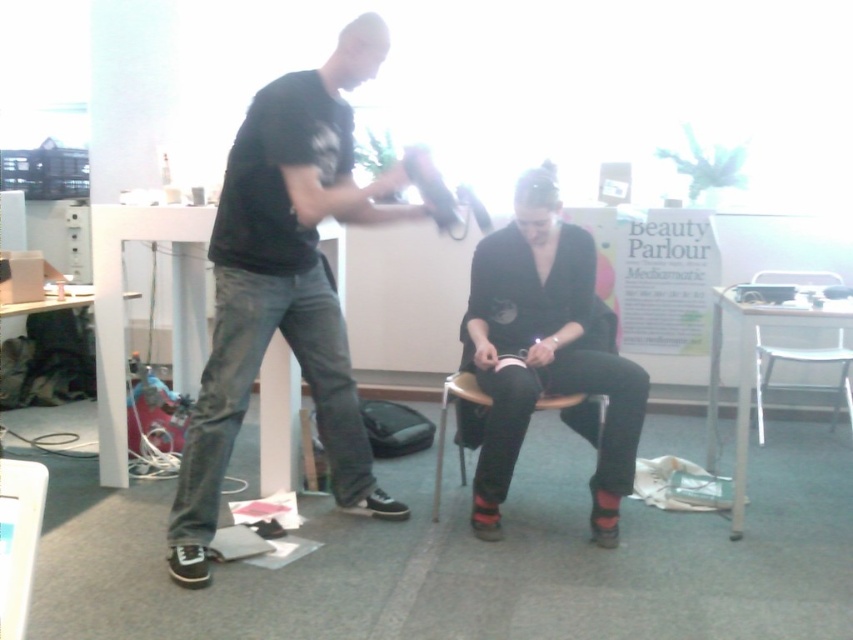
Question: Does matte black dress at center have a lesser width compared to metallic silver chair at lower right?

Choices:
 (A) yes
 (B) no

Answer: (A)

Question: Which of the following is the farthest from the observer?

Choices:
 (A) (833, 275)
 (B) (257, 284)
 (C) (537, 358)

Answer: (A)

Question: Considering the relative positions of matte black dress at center and metallic silver chair at lower right in the image provided, where is matte black dress at center located with respect to metallic silver chair at lower right?

Choices:
 (A) above
 (B) below

Answer: (A)

Question: Does metallic silver chair at lower right come behind wooden chair at center?

Choices:
 (A) yes
 (B) no

Answer: (A)

Question: Which object appears farthest from the camera in this image?

Choices:
 (A) wooden chair at center
 (B) black matte shirt at center

Answer: (A)

Question: Which of these objects is positioned closest to the metallic silver chair at lower right?

Choices:
 (A) black matte shirt at center
 (B) wooden chair at center
 (C) matte black dress at center

Answer: (C)